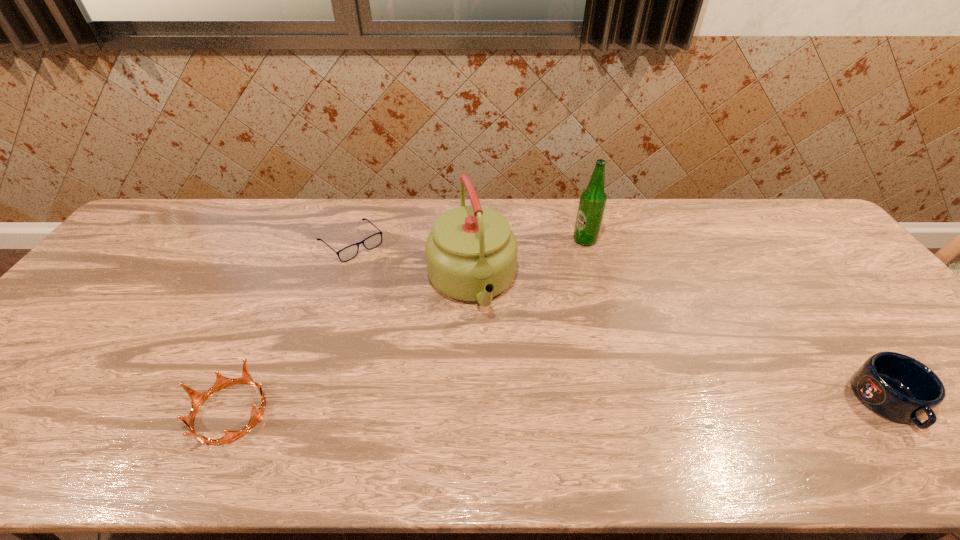
Where is `object at the near right corner`? object at the near right corner is located at coordinates (895, 386).

This screenshot has height=540, width=960. In the image, there is a desktop. Find the location of `vacant region at the far edge`. vacant region at the far edge is located at coordinates (717, 223).

Identify the location of vacant position at the near edge of the desktop. Image resolution: width=960 pixels, height=540 pixels. pyautogui.click(x=188, y=400).

The image size is (960, 540). I want to click on vacant area at the left edge of the desktop, so click(76, 304).

Identify the location of vacant space at the right edge of the desktop. (846, 314).

I want to click on vacant space at the far left corner of the desktop, so click(143, 231).

Identify the location of vacant space in between the kettle and the rightmost object. (680, 343).

At what (x,y) coordinates should I click in order to perform the action: click on free space that is in between the rightmost object and the shortest object. Please return your answer as a coordinate pair (x, y). This screenshot has height=540, width=960. Looking at the image, I should click on (619, 322).

This screenshot has width=960, height=540. What are the coordinates of `free spot between the second object from right to left and the third object from right to left` in the screenshot? It's located at (528, 261).

Identify the location of free space between the beer bottle and the crown. (407, 326).